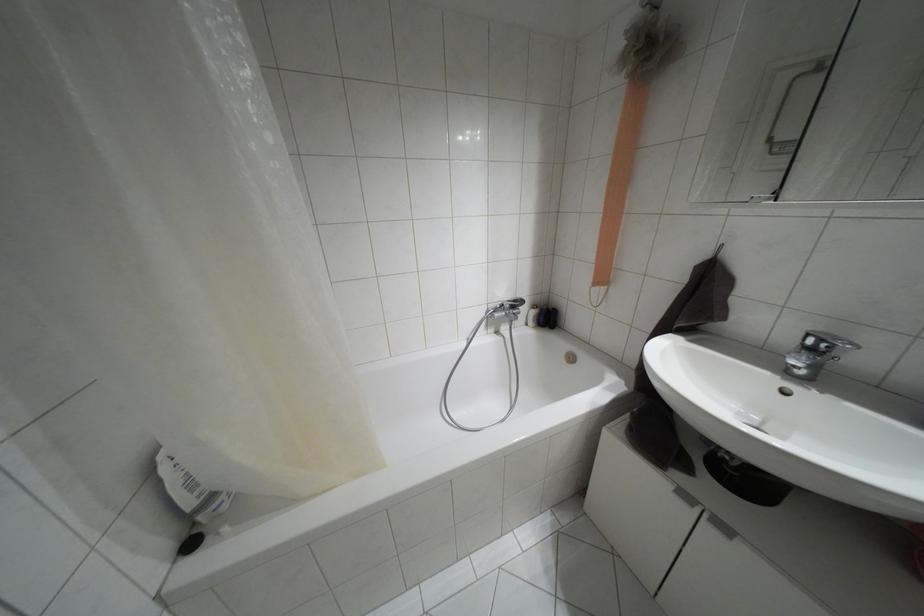
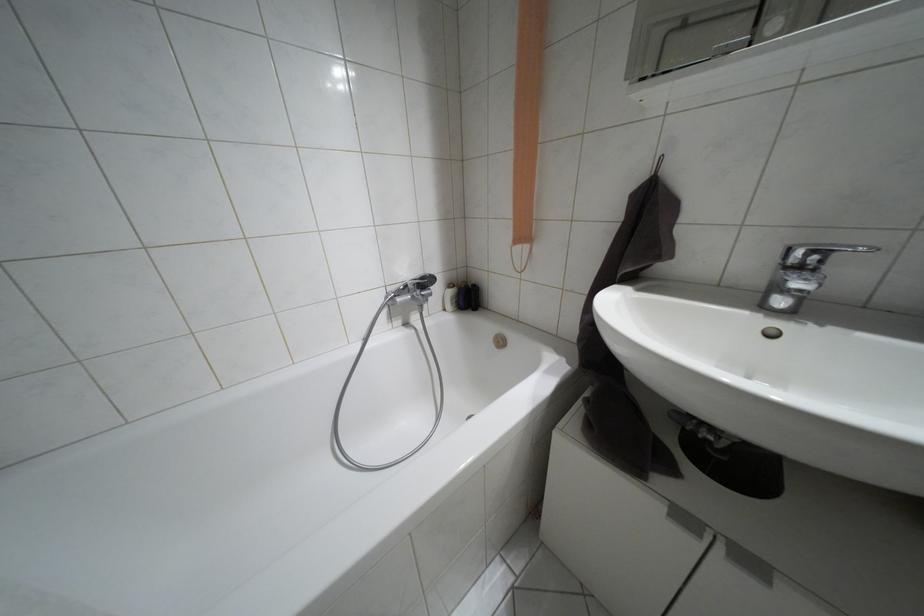
The images are taken continuously from a first-person perspective. In which direction are you moving?

The cameraman walked toward right, forward.